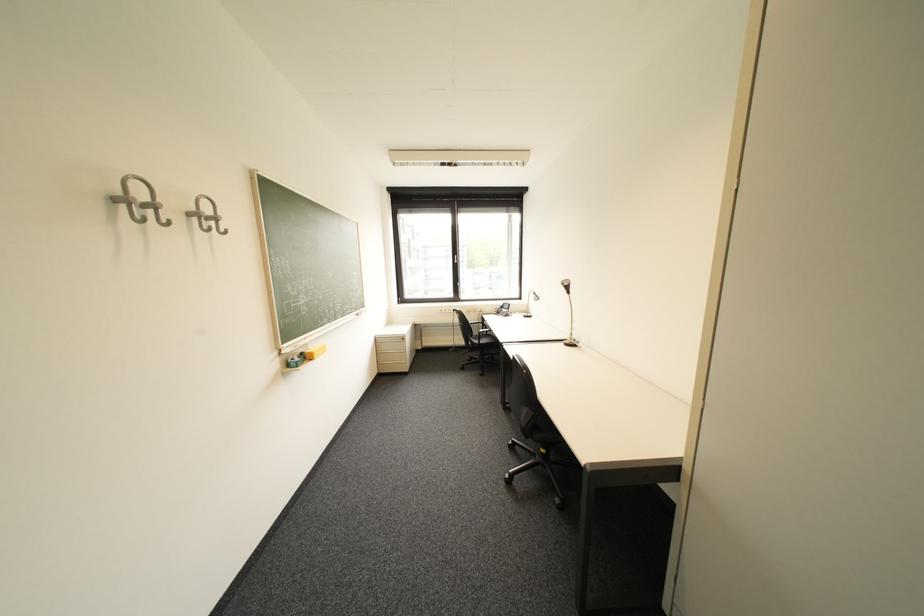
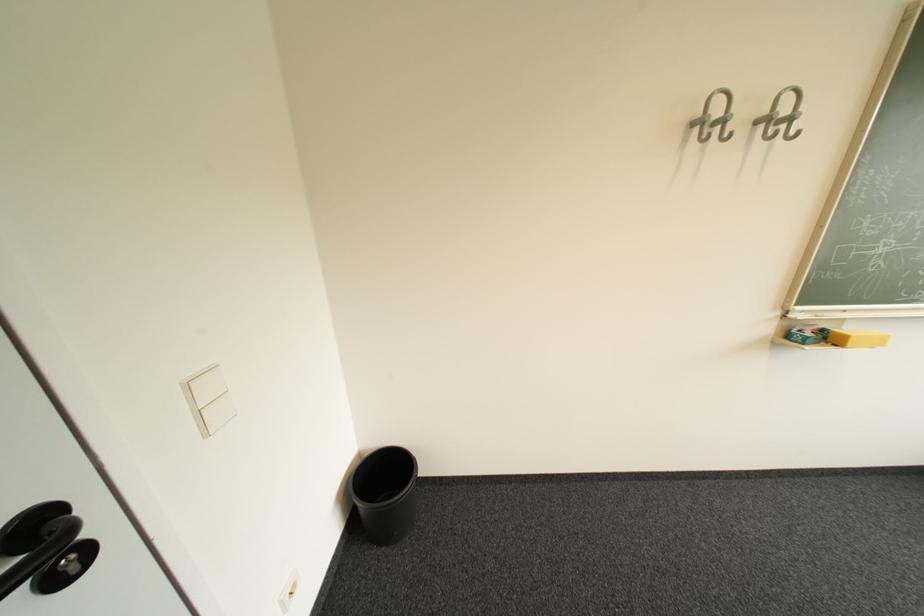
The point at (x=144, y=199) is marked in the first image. Where is the corresponding point in the second image?

(720, 116)